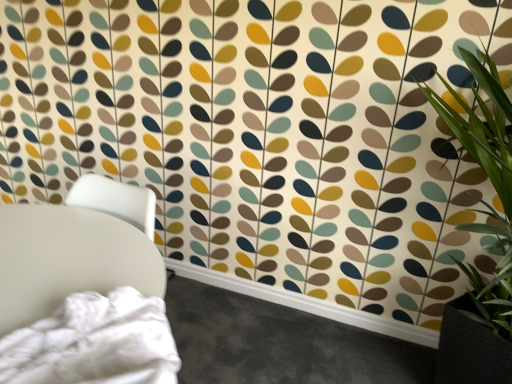
Where is `green leafy plant at right`? This screenshot has width=512, height=384. green leafy plant at right is located at coordinates (481, 233).

What do you see at coordinates (481, 233) in the screenshot? The height and width of the screenshot is (384, 512). I see `green leafy plant at right` at bounding box center [481, 233].

Describe the element at coordinates (68, 259) in the screenshot. I see `white matte chair at left` at that location.

Identify the location of white matte chair at left. [x=68, y=259].

Image resolution: width=512 pixels, height=384 pixels. Find the location of `green leafy plant at right`. green leafy plant at right is located at coordinates (481, 233).

Which is more to the left, white matte chair at left or green leafy plant at right?

From the viewer's perspective, white matte chair at left appears more on the left side.

Is white matte chair at left behind green leafy plant at right?

Yes, the depth of white matte chair at left is greater than that of green leafy plant at right.

Which is behind, point (62, 277) or point (474, 87)?

Positioned behind is point (474, 87).

From the image's perspective, which is above, white matte chair at left or green leafy plant at right?

green leafy plant at right.

From a real-world perspective, is white matte chair at left positioned under green leafy plant at right based on gravity?

Correct, in the physical world, white matte chair at left is lower than green leafy plant at right.

Which of these two, white matte chair at left or green leafy plant at right, is thinner?

With smaller width is white matte chair at left.

Who is shorter, white matte chair at left or green leafy plant at right?

Standing shorter between the two is white matte chair at left.

Is white matte chair at left bigger or smaller than green leafy plant at right?

In the image, white matte chair at left appears to be smaller than green leafy plant at right.

Is white matte chair at left spatially inside green leafy plant at right, or outside of it?

white matte chair at left lies outside green leafy plant at right.

Is white matte chair at left placed right next to green leafy plant at right?

white matte chair at left is not next to green leafy plant at right, and they're not touching.

Is white matte chair at left oriented away from green leafy plant at right?

No, white matte chair at left is not facing the opposite direction of green leafy plant at right.

How far apart are white matte chair at left and green leafy plant at right?

A distance of 1.16 meters exists between white matte chair at left and green leafy plant at right.

Where is `houseplant that appears above the white matte chair at left (from the image's perspective)`? This screenshot has height=384, width=512. houseplant that appears above the white matte chair at left (from the image's perspective) is located at coordinates (481, 233).

Which object is positioned more to the right, green leafy plant at right or white matte chair at left?

green leafy plant at right is more to the right.

Which object is closer to the camera, green leafy plant at right or white matte chair at left?

A: green leafy plant at right is more forward.

Which is in front, point (484, 151) or point (75, 245)?

The point (75, 245) is closer.

From the image's perspective, is green leafy plant at right located above or below white matte chair at left?

Clearly, from the image's perspective, green leafy plant at right is above white matte chair at left.

From a real-world perspective, is green leafy plant at right physically located above or below white matte chair at left?

From a real-world perspective, green leafy plant at right is physically above white matte chair at left.

In terms of width, does green leafy plant at right look wider or thinner when compared to white matte chair at left?

In the image, green leafy plant at right appears to be wider than white matte chair at left.

Does green leafy plant at right have a greater height compared to white matte chair at left?

Yes, green leafy plant at right is taller than white matte chair at left.

Which of these two, green leafy plant at right or white matte chair at left, is smaller?

white matte chair at left.

Would you say green leafy plant at right is inside or outside white matte chair at left?

The correct answer is: outside.

Does green leafy plant at right touch white matte chair at left?

No, green leafy plant at right is not with white matte chair at left.

Is green leafy plant at right turned away from white matte chair at left?

No, green leafy plant at right's orientation is not away from white matte chair at left.

How many degrees apart are the facing directions of green leafy plant at right and white matte chair at left?

90 degrees.

How much distance is there between green leafy plant at right and white matte chair at left?

green leafy plant at right and white matte chair at left are 3.80 feet apart.

Locate an element on the screen. The width and height of the screenshot is (512, 384). furniture below the green leafy plant at right (from the image's perspective) is located at coordinates (68, 259).

Identify the location of furniture behind the green leafy plant at right. This screenshot has height=384, width=512. (68, 259).

The width and height of the screenshot is (512, 384). Find the location of `furniture that appears below the green leafy plant at right (from a real-world perspective)`. furniture that appears below the green leafy plant at right (from a real-world perspective) is located at coordinates (68, 259).